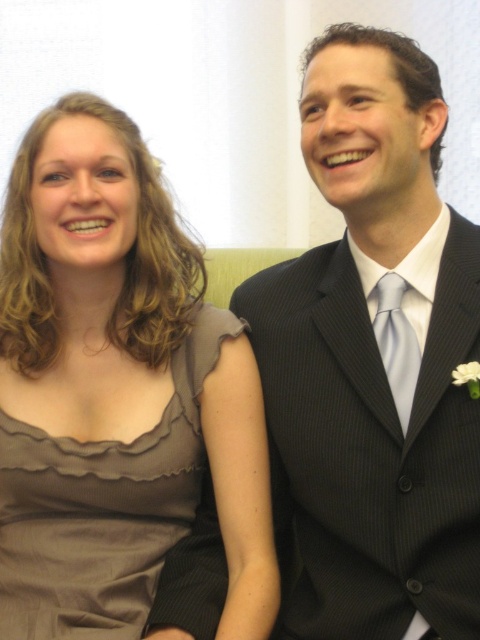
Question: Which of the following is the closest to the observer?

Choices:
 (A) light blue silk tie at center
 (B) satin dress at left

Answer: (B)

Question: Does satin dress at left have a smaller size compared to light blue silk tie at center?

Choices:
 (A) no
 (B) yes

Answer: (A)

Question: Among these points, which one is nearest to the camera?

Choices:
 (A) (139, 592)
 (B) (377, 340)

Answer: (B)

Question: Does satin dress at left appear over light blue silk tie at center?

Choices:
 (A) yes
 (B) no

Answer: (B)

Question: Is satin dress at left in front of light blue silk tie at center?

Choices:
 (A) no
 (B) yes

Answer: (B)